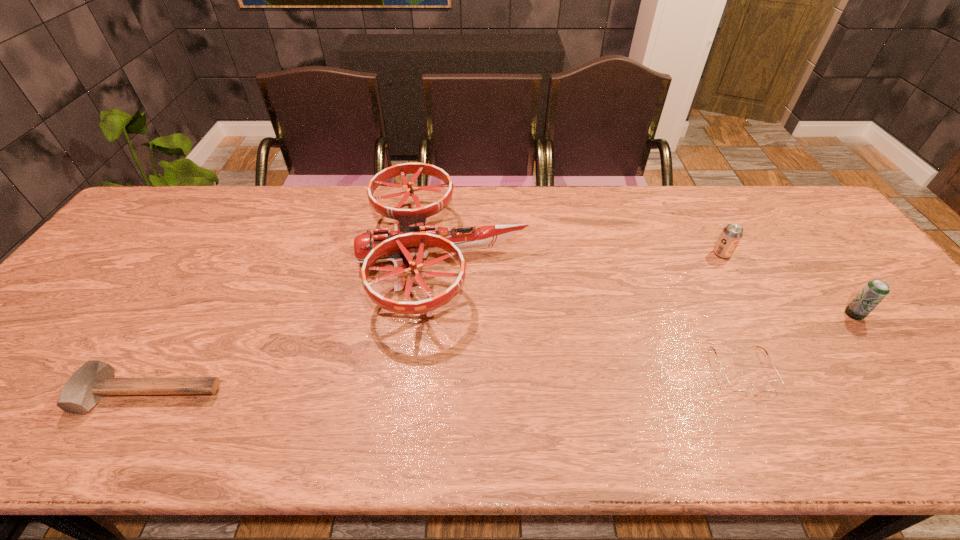
At what (x,y) coordinates should I click in order to perform the action: click on the tallest object. Please return your answer as a coordinate pair (x, y). Image resolution: width=960 pixels, height=540 pixels. Looking at the image, I should click on (411, 237).

Find the location of a particular element. the second object from left to right is located at coordinates (411, 237).

Identify the location of the rightmost object. 875,291.

Locate an element on the screen. This screenshot has height=540, width=960. the right beer can is located at coordinates (875, 291).

I want to click on the left beer can, so click(731, 235).

You are a GUI agent. You are given a task and a screenshot of the screen. Output one action in this format:
    pyautogui.click(x=<x>, y=<y>)
    Task: Click on the farther beer can
    
    Given the screenshot: What is the action you would take?
    pyautogui.click(x=731, y=235)

The image size is (960, 540). In order to click on mallet in this screenshot , I will do `click(86, 387)`.

Where is `the shortest object`? This screenshot has height=540, width=960. the shortest object is located at coordinates (742, 385).

Locate an element on the screen. This screenshot has width=960, height=540. the third object from left to right is located at coordinates (742, 385).

Locate an element on the screen. The image size is (960, 540). free space located 0.050m on the back of the tallest object is located at coordinates (449, 188).